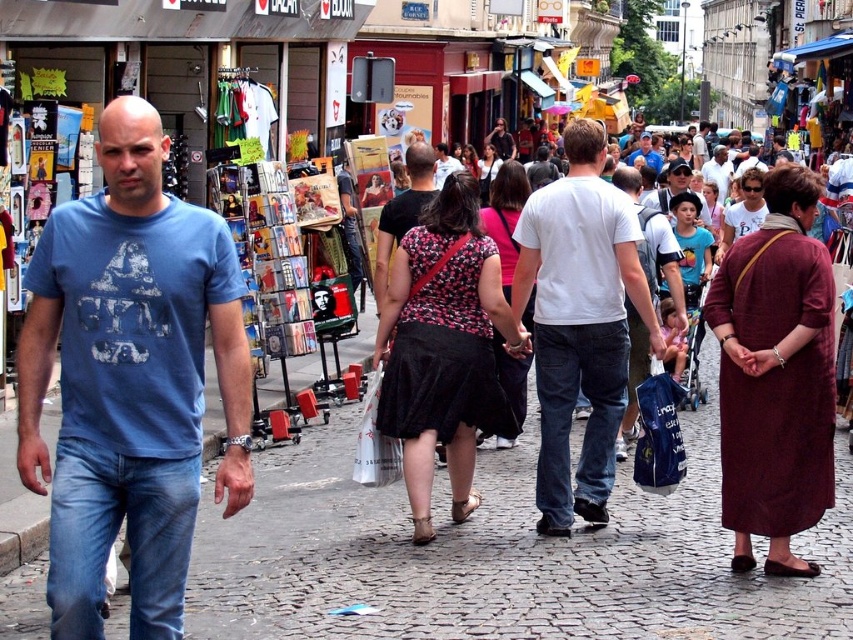
You are a photographer standing at the edge of the street. You want to take a photo of both the matte white shirt at center and the white cotton shirt at center in the same frame. Based on their distance from each other, will you be able to capture both in one shot without moving your camera?

The matte white shirt at center is 32.51 meters from the white cotton shirt at center. Since the distance between them is quite large, it might be challenging to capture both in one frame without moving the camera, depending on the lens used. However, with a wide enough angle lens, it could be possible.

You are standing at point (131, 380) in the scene. What object is located at this point?

The blue cotton t shirt at left is located at point (131, 380).